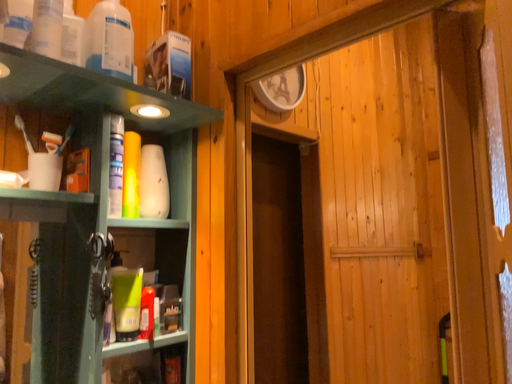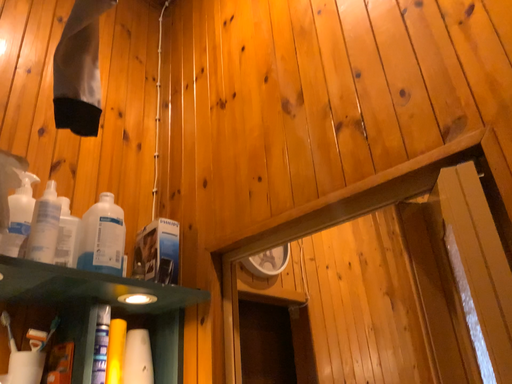
Question: Which way did the camera rotate in the video?

Choices:
 (A) rotated upward
 (B) rotated downward

Answer: (A)